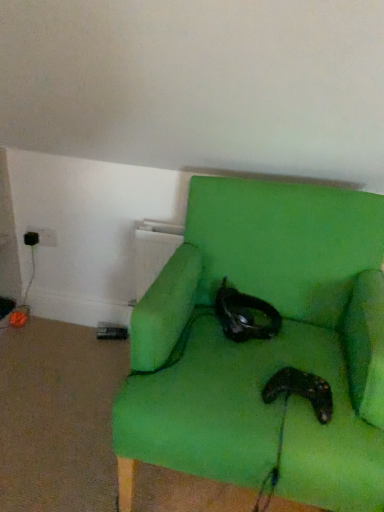
What do you see at coordinates (244, 315) in the screenshot? I see `black matte cat at center` at bounding box center [244, 315].

What do you see at coordinates (301, 390) in the screenshot?
I see `black matte controller at lower center` at bounding box center [301, 390].

Identify the location of black matte controller at lower center. (301, 390).

I want to click on black matte cat at center, so click(244, 315).

Is black matte cat at center to the left or to the right of black matte controller at lower center in the image?

Based on their positions, black matte cat at center is located to the left of black matte controller at lower center.

Between point (223, 284) and point (307, 372), which one is positioned in front?

Positioned in front is point (307, 372).

Considering the sizes of black matte cat at center and black matte controller at lower center in the image, is black matte cat at center wider or thinner than black matte controller at lower center?

Clearly, black matte cat at center has more width compared to black matte controller at lower center.

Is black matte cat at center positioned with its back to black matte controller at lower center?

black matte cat at center does not have its back to black matte controller at lower center.

Is black matte cat at center positioned with its back to green fabric chair at center?

Yes.

Is black matte cat at center with green fabric chair at center?

No, black matte cat at center is not in contact with green fabric chair at center.

Does black matte cat at center come behind green fabric chair at center?

Yes, black matte cat at center is behind green fabric chair at center.

Can you confirm if black matte cat at center is positioned to the left of green fabric chair at center?

Yes.

Based on the photo, which of these two, black matte controller at lower center or black matte cat at center, is wider?

Wider between the two is black matte cat at center.

Which object is more forward, black matte controller at lower center or black matte cat at center?

Positioned in front is black matte controller at lower center.

Is point (288, 384) closer or farther from the camera than point (279, 330)?

Clearly, point (288, 384) is closer to the camera than point (279, 330).

Are black matte controller at lower center and black matte cat at center far apart?

No, there isn't a large distance between black matte controller at lower center and black matte cat at center.

Is green fabric chair at center oriented away from black matte controller at lower center?

Yes.

Based on the photo, which object is thinner, green fabric chair at center or black matte controller at lower center?

black matte controller at lower center is thinner.

Which object is positioned more to the left, green fabric chair at center or black matte controller at lower center?

green fabric chair at center is more to the left.

From the image's perspective, is green fabric chair at center below black matte controller at lower center?

Incorrect, from the image's perspective, green fabric chair at center is higher than black matte controller at lower center.

Relative to black matte cat at center, is green fabric chair at center in front or behind?

green fabric chair at center is positioned closer to the viewer than black matte cat at center.

Is point (190, 341) positioned after point (253, 330)?

No, it is not.

Which of these two, green fabric chair at center or black matte cat at center, stands taller?

Standing taller between the two is green fabric chair at center.

Would you say green fabric chair at center is a long distance from black matte cat at center?

green fabric chair at center is near black matte cat at center, not far away.

Where is `footwear located above the green fabric chair at center (from a real-world perspective)`? The width and height of the screenshot is (384, 512). footwear located above the green fabric chair at center (from a real-world perspective) is located at coordinates (301, 390).

Looking at this image, considering the relative sizes of black matte controller at lower center and green fabric chair at center in the image provided, is black matte controller at lower center taller than green fabric chair at center?

Incorrect, the height of black matte controller at lower center is not larger of that of green fabric chair at center.

Is black matte controller at lower center not within green fabric chair at center?

No, black matte controller at lower center is not outside of green fabric chair at center.

Is black matte controller at lower center smaller than green fabric chair at center?

Yes.

The width and height of the screenshot is (384, 512). I want to click on cat above the black matte controller at lower center (from a real-world perspective), so 244,315.

You are a GUI agent. You are given a task and a screenshot of the screen. Output one action in this format:
    pyautogui.click(x=<x>, y=<y>)
    Task: Click on the chair below the black matte cat at center (from the image's perspective)
    This screenshot has height=512, width=384.
    Given the screenshot: What is the action you would take?
    pyautogui.click(x=263, y=346)

From the image, which object appears to be nearer to green fabric chair at center, black matte cat at center or black matte controller at lower center?

black matte cat at center is positioned closer to the anchor green fabric chair at center.

Estimate the real-world distances between objects in this image. Which object is further from green fabric chair at center, black matte controller at lower center or black matte cat at center?

Among the two, black matte controller at lower center is located further to green fabric chair at center.

Considering their positions, is black matte controller at lower center positioned closer to black matte cat at center than green fabric chair at center?

Based on the image, green fabric chair at center appears to be nearer to black matte cat at center.

Based on their spatial positions, is green fabric chair at center or black matte controller at lower center closer to black matte cat at center?

green fabric chair at center is positioned closer to the anchor black matte cat at center.

Considering their positions, is green fabric chair at center positioned further to black matte controller at lower center than black matte cat at center?

black matte cat at center is further to black matte controller at lower center.

Estimate the real-world distances between objects in this image. Which object is further from black matte controller at lower center, black matte cat at center or green fabric chair at center?

black matte cat at center lies further to black matte controller at lower center than the other object.

Where is `footwear between green fabric chair at center and black matte cat at center along the z-axis`? This screenshot has width=384, height=512. footwear between green fabric chair at center and black matte cat at center along the z-axis is located at coordinates (301, 390).